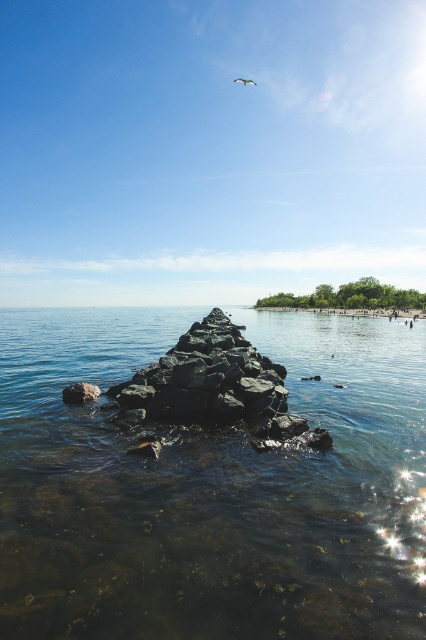
Is point (71, 385) less distant than point (255, 83)?

That is True.

Between gray rough rock at lower left and white feathered bird at upper center, which one is positioned lower?

gray rough rock at lower left is below.

Which is in front, point (75, 396) or point (242, 81)?

Point (75, 396)

This screenshot has width=426, height=640. Find the location of `gray rough rock at lower left`. gray rough rock at lower left is located at coordinates (80, 392).

Does clear water at center appear on the left side of white feathered bird at upper center?

Yes, clear water at center is to the left of white feathered bird at upper center.

Which is in front, point (245, 561) or point (249, 80)?

Positioned in front is point (245, 561).

The width and height of the screenshot is (426, 640). What are the coordinates of `clear water at center` in the screenshot? It's located at (210, 488).

Does clear water at center have a lesser width compared to gray rough rock at lower left?

In fact, clear water at center might be wider than gray rough rock at lower left.

Between point (348, 474) and point (83, 401), which one is positioned behind?

The point (83, 401) is behind.

Between point (340, 536) and point (63, 394), which one is positioned behind?

Point (63, 394)

Locate an element on the screen. clear water at center is located at coordinates (210, 488).